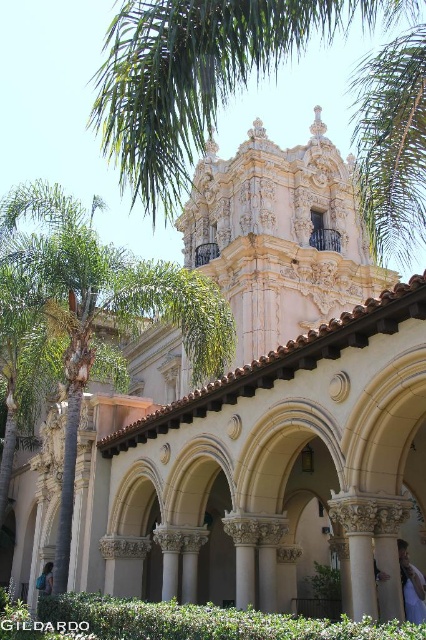
Question: Can you confirm if green leafy palm tree at upper center is thinner than green leafy palm tree at center?

Choices:
 (A) yes
 (B) no

Answer: (B)

Question: Is green leafy palm tree at upper center positioned in front of blue fabric at lower right?

Choices:
 (A) yes
 (B) no

Answer: (A)

Question: Which of the following is the farthest from the observer?

Choices:
 (A) (37, 584)
 (B) (377, 186)
 (C) (45, 204)

Answer: (A)

Question: Among these objects, which one is nearest to the camera?

Choices:
 (A) blue fabric at lower right
 (B) blue backpack at center
 (C) green leafy palm tree at upper center
 (D) green leafy palm tree at center

Answer: (C)

Question: Can you confirm if green leafy palm tree at center is smaller than blue backpack at center?

Choices:
 (A) no
 (B) yes

Answer: (A)

Question: Which point is farther to the camera?

Choices:
 (A) blue fabric at lower right
 (B) blue backpack at center
 (C) green leafy palm tree at upper center
 (D) green leafy palm tree at center

Answer: (B)